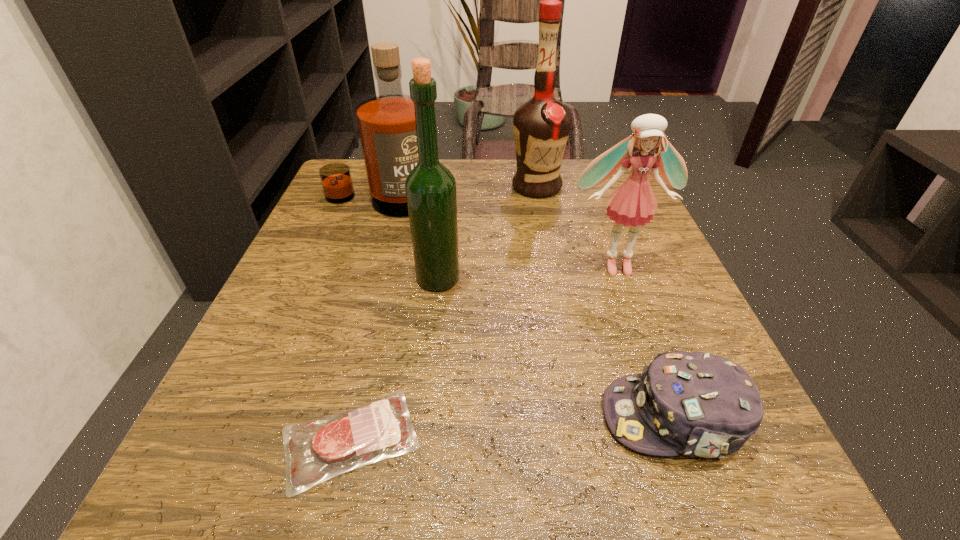
Identify the location of object located at the near left corner. Image resolution: width=960 pixels, height=540 pixels. (315, 451).

Image resolution: width=960 pixels, height=540 pixels. I want to click on object that is at the far right corner, so click(541, 126).

The width and height of the screenshot is (960, 540). I want to click on object situated at the near right corner, so click(x=699, y=404).

You are a GUI agent. You are given a task and a screenshot of the screen. Output one action in this format:
    pyautogui.click(x=<x>, y=<y>)
    Task: Click on the vacant space at the far edge
    The image size is (960, 540).
    Given the screenshot: What is the action you would take?
    pyautogui.click(x=508, y=166)

Locate an element on the screen. vacant space at the near edge of the desktop is located at coordinates (488, 465).

Identify the location of vacant position at the left edge of the desktop. The height and width of the screenshot is (540, 960). (317, 364).

This screenshot has width=960, height=540. In the image, there is a desktop. Find the location of `free space at the right edge`. free space at the right edge is located at coordinates (680, 330).

Locate an element on the screen. vacant space at the far left corner of the desktop is located at coordinates (358, 175).

In the image, there is a desktop. At what (x,y) coordinates should I click in order to perform the action: click on free space at the far right corner. Please return your answer as a coordinate pair (x, y). The height and width of the screenshot is (540, 960). Looking at the image, I should click on (624, 181).

I want to click on free space between the doll and the shortest object, so click(483, 352).